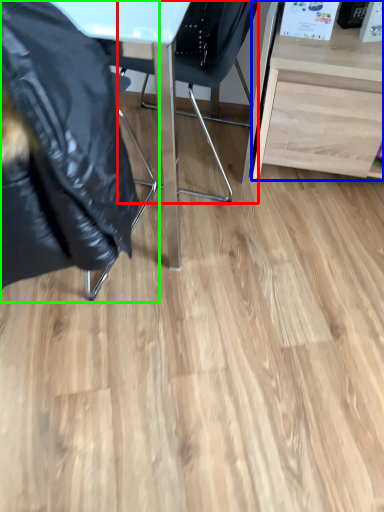
Question: Which object is positioned farthest from chair (highlighted by a red box)? Select from desk (highlighted by a blue box) and chair (highlighted by a green box).

Choices:
 (A) desk
 (B) chair

Answer: (B)